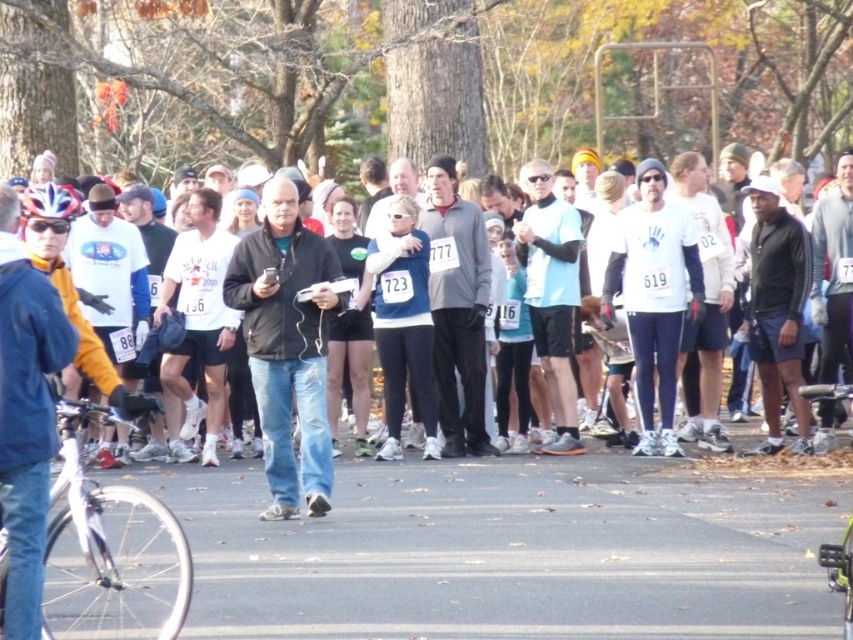
Question: Which point is closer to the camera?

Choices:
 (A) (840, 588)
 (B) (79, 493)

Answer: (A)

Question: Is white matte bicycle at lower left wider than green matte bicycle at lower right?

Choices:
 (A) yes
 (B) no

Answer: (A)

Question: Considering the relative positions of white matte bicycle at lower left and green matte bicycle at lower right in the image provided, where is white matte bicycle at lower left located with respect to green matte bicycle at lower right?

Choices:
 (A) left
 (B) right

Answer: (A)

Question: Observing the image, what is the correct spatial positioning of white matte bicycle at lower left in reference to green matte bicycle at lower right?

Choices:
 (A) right
 (B) left

Answer: (B)

Question: Which point is closer to the camera taking this photo?

Choices:
 (A) (143, 548)
 (B) (836, 564)

Answer: (B)